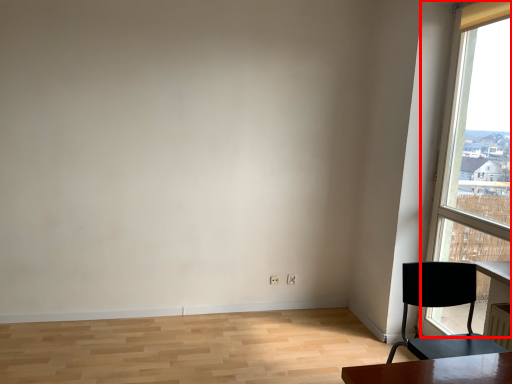
Question: Where is window (annotated by the red box) located in relation to chair in the image?

Choices:
 (A) left
 (B) right

Answer: (B)